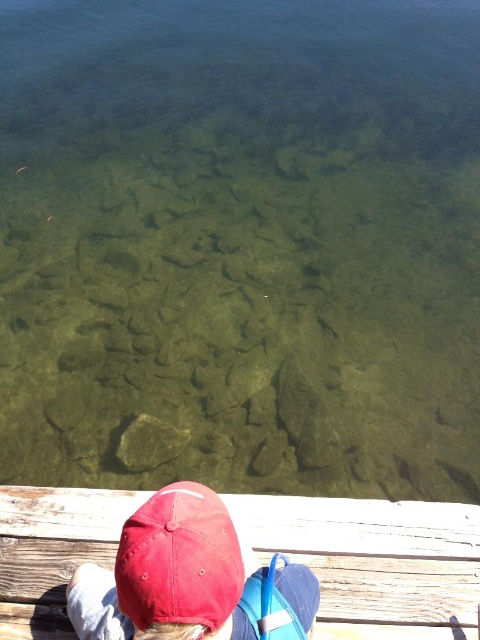
Question: In this image, where is wooden dock at lower center located relative to matte red baseball cap at lower left?

Choices:
 (A) left
 (B) right

Answer: (B)

Question: Which point appears closest to the camera in this image?

Choices:
 (A) (136, 602)
 (B) (19, 524)

Answer: (A)

Question: Which point appears farthest from the camera in this image?

Choices:
 (A) (309, 524)
 (B) (207, 563)

Answer: (A)

Question: Is wooden dock at lower center to the right of matte red baseball cap at lower left from the viewer's perspective?

Choices:
 (A) no
 (B) yes

Answer: (B)

Question: Is wooden dock at lower center to the left of matte red baseball cap at lower left from the viewer's perspective?

Choices:
 (A) yes
 (B) no

Answer: (B)